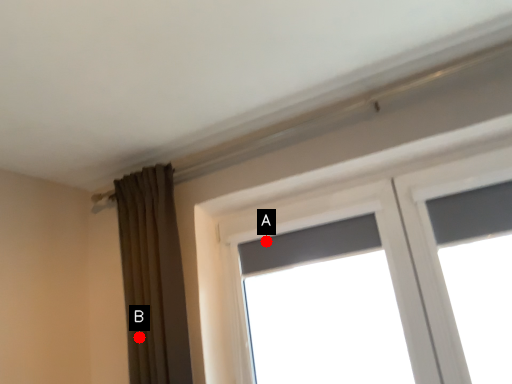
Question: Two points are circled on the image, labeled by A and B beside each circle. Which point is further to the camera?

Choices:
 (A) A is further
 (B) B is further

Answer: (A)